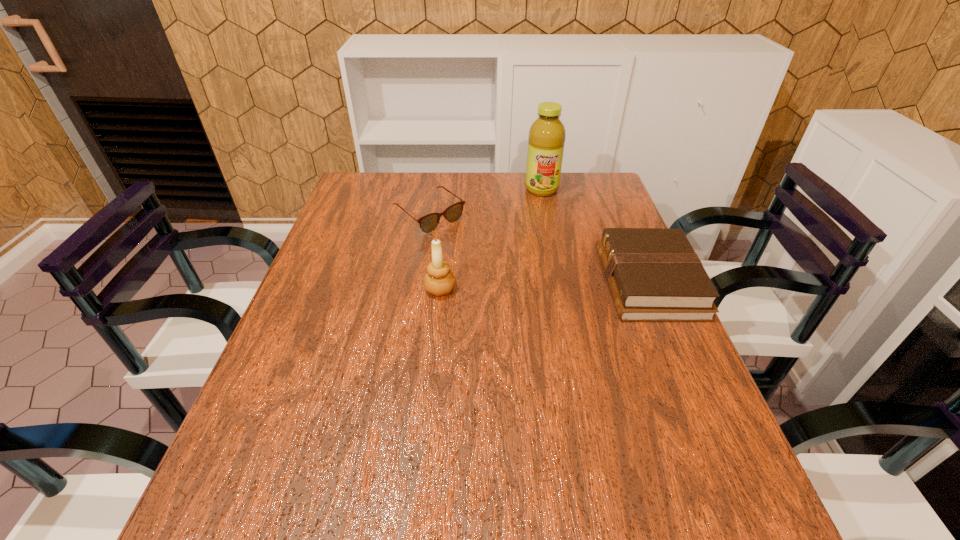
Identify the location of candle_holder. (439, 280).

Identify the location of Bible. (654, 275).

This screenshot has width=960, height=540. In order to click on the rightmost object in this screenshot , I will do `click(654, 275)`.

You are a GUI agent. You are given a task and a screenshot of the screen. Output one action in this format:
    pyautogui.click(x=<x>, y=<y>)
    Task: Click on the shortest object
    
    Given the screenshot: What is the action you would take?
    pyautogui.click(x=429, y=222)

Where is `fruit juice`? This screenshot has width=960, height=540. fruit juice is located at coordinates (546, 139).

Locate an element on the screen. The image size is (960, 540). the second object from right to left is located at coordinates (546, 139).

Identify the location of free location located 0.340m on the back of the candle_holder. Image resolution: width=960 pixels, height=540 pixels. (448, 207).

Where is `free space located on the spine side of the third tallest object`? The image size is (960, 540). free space located on the spine side of the third tallest object is located at coordinates (574, 282).

Locate an element on the screen. This screenshot has width=960, height=540. free region located on the spine side of the third tallest object is located at coordinates (499, 282).

Locate an element on the screen. free point located on the spine side of the third tallest object is located at coordinates (574, 282).